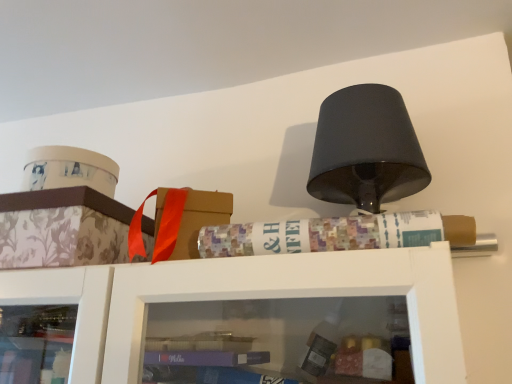
Describe the element at coordinates (336, 234) in the screenshot. The width and height of the screenshot is (512, 384). I see `multicolored paper at upper center` at that location.

I want to click on multicolored paper at upper center, so click(x=336, y=234).

Locate an element on the screen. floral-patterned cardboard box at left is located at coordinates (62, 228).

In order to face floral-patterned cardboard box at left, should I rotate leftwards or rightwards?

Turn left approximately 23.883 degrees to face it.

What is the approximate width of floral-patterned cardboard box at left?

floral-patterned cardboard box at left is 9.44 inches in width.

Describe the element at coordinates (62, 228) in the screenshot. I see `floral-patterned cardboard box at left` at that location.

At what (x,y) coordinates should I click in order to perform the action: click on multicolored paper at upper center. Please return your answer as a coordinate pair (x, y). Looking at the image, I should click on (336, 234).

Which object is positioned more to the left, floral-patterned cardboard box at left or multicolored paper at upper center?

Positioned to the left is floral-patterned cardboard box at left.

Between floral-patterned cardboard box at left and multicolored paper at upper center, which one is positioned behind?

floral-patterned cardboard box at left is more distant.

Does point (28, 231) lie in front of point (312, 219)?

Yes, it is.

From the image's perspective, between floral-patterned cardboard box at left and multicolored paper at upper center, who is located below?

From the image's view, floral-patterned cardboard box at left is below.

From a real-world perspective, does floral-patterned cardboard box at left stand above multicolored paper at upper center?

Indeed, from a real-world perspective, floral-patterned cardboard box at left stands above multicolored paper at upper center.

Is floral-patterned cardboard box at left thinner than multicolored paper at upper center?

Incorrect, the width of floral-patterned cardboard box at left is not less than that of multicolored paper at upper center.

Considering the sizes of objects floral-patterned cardboard box at left and multicolored paper at upper center in the image provided, who is taller, floral-patterned cardboard box at left or multicolored paper at upper center?

Standing taller between the two is floral-patterned cardboard box at left.

In the scene shown: Is floral-patterned cardboard box at left bigger than multicolored paper at upper center?

Yes.

Choose the correct answer: Is floral-patterned cardboard box at left inside multicolored paper at upper center or outside it?

floral-patterned cardboard box at left is spatially situated outside multicolored paper at upper center.

Is floral-patterned cardboard box at left not close to multicolored paper at upper center?

No.

Is floral-patterned cardboard box at left turned away from multicolored paper at upper center?

floral-patterned cardboard box at left does not have its back to multicolored paper at upper center.

Find the location of `cabinetry below the multicolored paper at upper center (from the image's perspective)`. cabinetry below the multicolored paper at upper center (from the image's perspective) is located at coordinates (62, 228).

Visually, is multicolored paper at upper center positioned to the left or to the right of floral-patterned cardboard box at left?

Based on their positions, multicolored paper at upper center is located to the right of floral-patterned cardboard box at left.

Does multicolored paper at upper center come behind floral-patterned cardboard box at left?

No, it is in front of floral-patterned cardboard box at left.

Considering the positions of points (214, 241) and (6, 247), is point (214, 241) farther from camera compared to point (6, 247)?

No, (214, 241) is in front of (6, 247).

From the image's perspective, is multicolored paper at upper center above floral-patterned cardboard box at left?

Yes, from the image's perspective, multicolored paper at upper center is above floral-patterned cardboard box at left.

From a real-world perspective, which is physically below, multicolored paper at upper center or floral-patterned cardboard box at left?

multicolored paper at upper center.

Which of these two, multicolored paper at upper center or floral-patterned cardboard box at left, is wider?

floral-patterned cardboard box at left is wider.

Considering the sizes of objects multicolored paper at upper center and floral-patterned cardboard box at left in the image provided, who is taller, multicolored paper at upper center or floral-patterned cardboard box at left?

floral-patterned cardboard box at left.

Does multicolored paper at upper center have a smaller size compared to floral-patterned cardboard box at left?

Yes.

Looking at this image, is multicolored paper at upper center inside the boundaries of floral-patterned cardboard box at left, or outside?

multicolored paper at upper center is outside floral-patterned cardboard box at left.

Is multicolored paper at upper center directly adjacent to floral-patterned cardboard box at left?

No, multicolored paper at upper center is not next to floral-patterned cardboard box at left.

Is multicolored paper at upper center positioned with its back to floral-patterned cardboard box at left?

No, floral-patterned cardboard box at left is not at the back of multicolored paper at upper center.

Where is `book to the right of floral-patterned cardboard box at left`? The height and width of the screenshot is (384, 512). book to the right of floral-patterned cardboard box at left is located at coordinates (336, 234).

You are a GUI agent. You are given a task and a screenshot of the screen. Output one action in this format:
    pyautogui.click(x=<x>, y=<y>)
    Task: Click on the book below the floral-patterned cardboard box at left (from a real-world perspective)
    This screenshot has width=512, height=384.
    Given the screenshot: What is the action you would take?
    pyautogui.click(x=336, y=234)

Where is `cabinetry on the left of multicolored paper at upper center`? cabinetry on the left of multicolored paper at upper center is located at coordinates (62, 228).